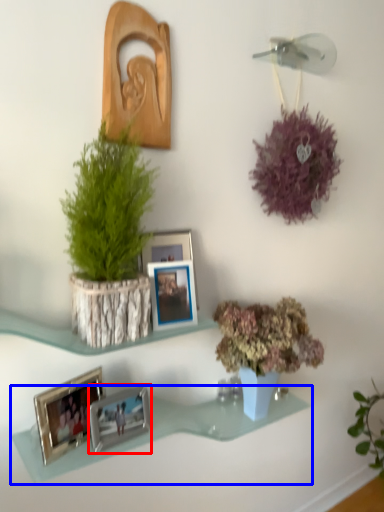
Question: Which of the following is the farthest to the observer, picture frame (highlighted by a red box) or shelf (highlighted by a blue box)?

Choices:
 (A) picture frame
 (B) shelf

Answer: (A)